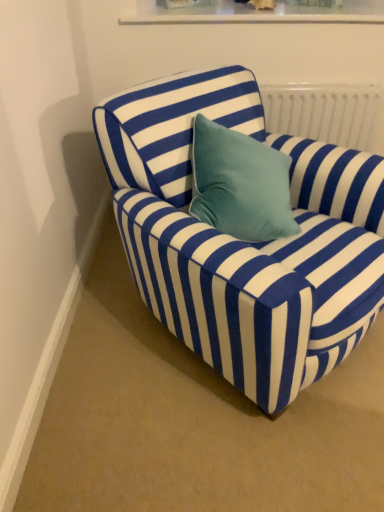
Measure the distance between blue striped fabric chair at center and camera.

blue striped fabric chair at center is 37.86 inches from camera.

Image resolution: width=384 pixels, height=512 pixels. What do you see at coordinates (245, 242) in the screenshot? I see `blue striped fabric chair at center` at bounding box center [245, 242].

Looking at this image, measure the distance between point (275, 297) and camera.

The distance of point (275, 297) from camera is 96.00 centimeters.

Find the location of `blue striped fabric chair at center`. blue striped fabric chair at center is located at coordinates (245, 242).

This screenshot has width=384, height=512. Find the location of `blue striped fabric chair at center`. blue striped fabric chair at center is located at coordinates (245, 242).